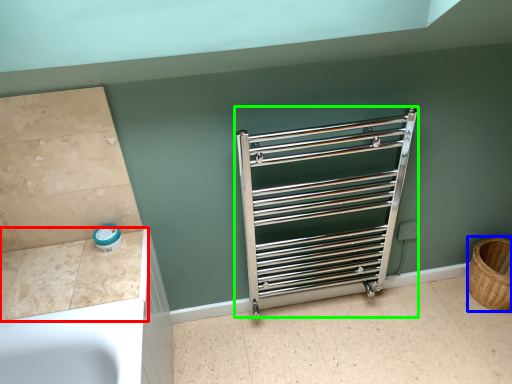
Question: Which is farther away from counter top (highlighted by a red box)? basket (highlighted by a blue box) or cage (highlighted by a green box)?

Choices:
 (A) basket
 (B) cage

Answer: (A)